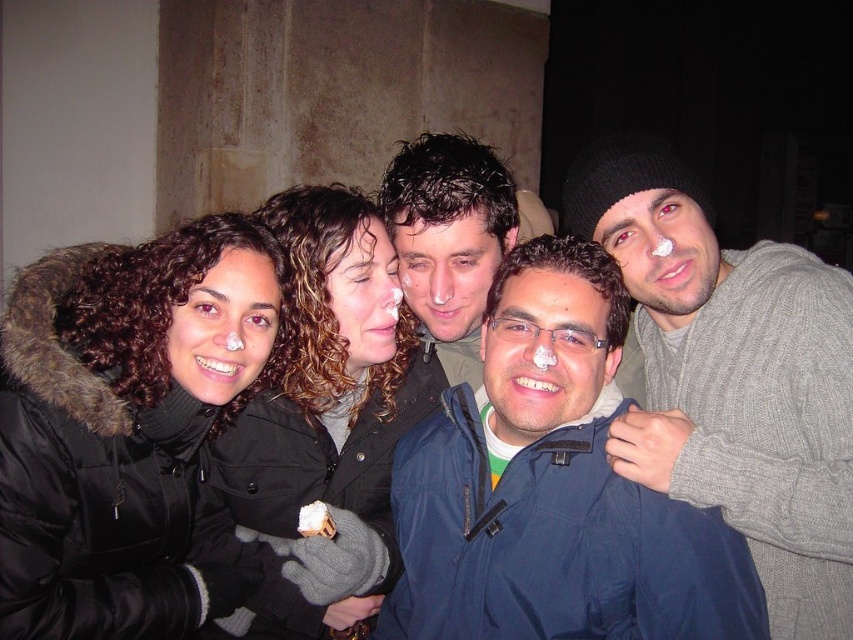
Question: Does black matte jacket at center have a lesser width compared to matte black jacket at center?

Choices:
 (A) no
 (B) yes

Answer: (A)

Question: Observing the image, what is the correct spatial positioning of gray knit sweater at right in reference to black matte jacket at center?

Choices:
 (A) below
 (B) above

Answer: (B)

Question: Estimate the real-world distances between objects in this image. Which object is farther from the gray knit sweater at right?

Choices:
 (A) black fur-lined coat at left
 (B) matte black jacket at center
 (C) black matte jacket at center
 (D) blue fabric jacket at center

Answer: (A)

Question: Which point is farther to the camera?

Choices:
 (A) gray knit sweater at right
 (B) matte black jacket at center
 (C) black matte jacket at center
 (D) blue fabric jacket at center

Answer: (B)

Question: Does blue fabric jacket at center appear on the left side of gray knit sweater at right?

Choices:
 (A) yes
 (B) no

Answer: (A)

Question: Which object appears farthest from the camera in this image?

Choices:
 (A) black fur-lined coat at left
 (B) matte black jacket at center

Answer: (B)